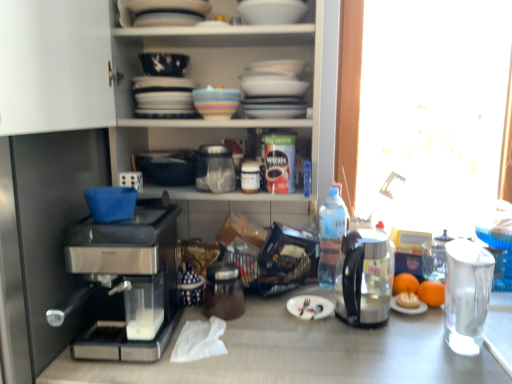
Question: Considering the relative sizes of transparent plastic bottle at right, the 2th bottle from the left, and orange matte at right, arranged as the 1th orange when viewed from the right, in the image provided, is transparent plastic bottle at right, the 2th bottle from the left, taller than orange matte at right, arranged as the 1th orange when viewed from the right,?

Choices:
 (A) yes
 (B) no

Answer: (A)

Question: Considering the relative sizes of transparent plastic bottle at right, placed as the 1th bottle when sorted from back to front, and orange matte at right, acting as the 2th orange starting from the left, in the image provided, is transparent plastic bottle at right, placed as the 1th bottle when sorted from back to front, smaller than orange matte at right, acting as the 2th orange starting from the left,?

Choices:
 (A) no
 (B) yes

Answer: (A)

Question: Is transparent plastic bottle at right, which is the second bottle in right-to-left order, next to orange matte at right, acting as the 2th orange starting from the left, and touching it?

Choices:
 (A) yes
 (B) no

Answer: (B)

Question: From the image's perspective, is transparent plastic bottle at right, the 3th bottle viewed from the front, above orange matte at right, acting as the 2th orange starting from the left?

Choices:
 (A) yes
 (B) no

Answer: (A)

Question: Is there a large distance between transparent plastic bottle at right, placed as the 1th bottle when sorted from back to front, and orange matte at right, acting as the 2th orange starting from the left?

Choices:
 (A) no
 (B) yes

Answer: (A)

Question: Is shiny metallic coffee maker at center, the second appliance in the top-to-bottom sequence, wider or thinner than multicolored ceramic bowl at center, which ranks as the first tableware in left-to-right order?

Choices:
 (A) thin
 (B) wide

Answer: (B)

Question: Is point (219, 269) closer or farther from the camera than point (222, 99)?

Choices:
 (A) closer
 (B) farther

Answer: (B)

Question: Is shiny metallic coffee maker at center, the 1th appliance from the bottom, spatially inside multicolored ceramic bowl at center, placed as the first tableware when sorted from bottom to top, or outside of it?

Choices:
 (A) outside
 (B) inside

Answer: (A)

Question: From a real-world perspective, is shiny metallic coffee maker at center, the 1th appliance from the bottom, positioned above or below multicolored ceramic bowl at center, which ranks as the first tableware in left-to-right order?

Choices:
 (A) below
 (B) above

Answer: (A)

Question: Considering the relative positions of white matte paper plate at center and transparent glass jar at center, the first appliance in the top-to-bottom sequence, in the image provided, is white matte paper plate at center to the left or to the right of transparent glass jar at center, the first appliance in the top-to-bottom sequence,?

Choices:
 (A) left
 (B) right

Answer: (B)

Question: Is point (310, 317) closer or farther from the camera than point (208, 178)?

Choices:
 (A) farther
 (B) closer

Answer: (B)

Question: From the image's perspective, is white matte paper plate at center located above or below transparent glass jar at center, the first appliance in the top-to-bottom sequence?

Choices:
 (A) below
 (B) above

Answer: (A)

Question: In terms of width, does white matte paper plate at center look wider or thinner when compared to transparent glass jar at center, placed as the 2th appliance when sorted from bottom to top?

Choices:
 (A) wide
 (B) thin

Answer: (B)

Question: Is shiny metallic coffee maker at center, the 1th appliance from the bottom, inside the boundaries of silver metallic fork at center, or outside?

Choices:
 (A) outside
 (B) inside

Answer: (A)

Question: From a real-world perspective, relative to silver metallic fork at center, is shiny metallic coffee maker at center, the second appliance in the top-to-bottom sequence, vertically above or below?

Choices:
 (A) below
 (B) above

Answer: (B)